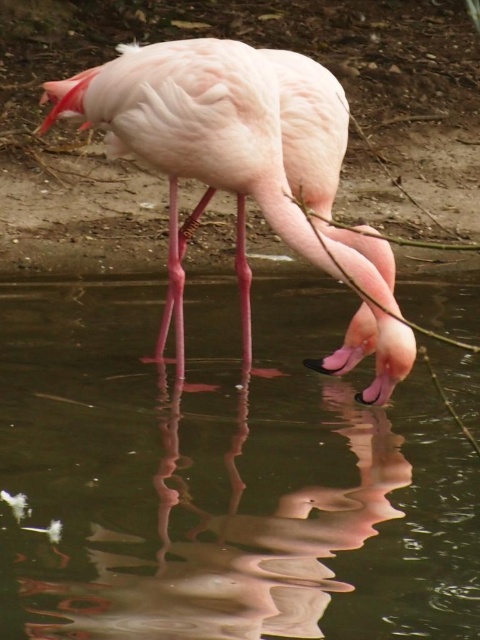
Does transparent liquid water at center appear over pink feathered flamingo at center?

Actually, transparent liquid water at center is below pink feathered flamingo at center.

Between point (345, 536) and point (322, 202), which one is positioned behind?

Point (322, 202)

Is point (372, 492) farther from viewer compared to point (389, 276)?

That is False.

At what (x,y) coordinates should I click in order to perform the action: click on transparent liquid water at center. Please return your answer as a coordinate pair (x, y). This screenshot has width=480, height=640. Looking at the image, I should click on (220, 477).